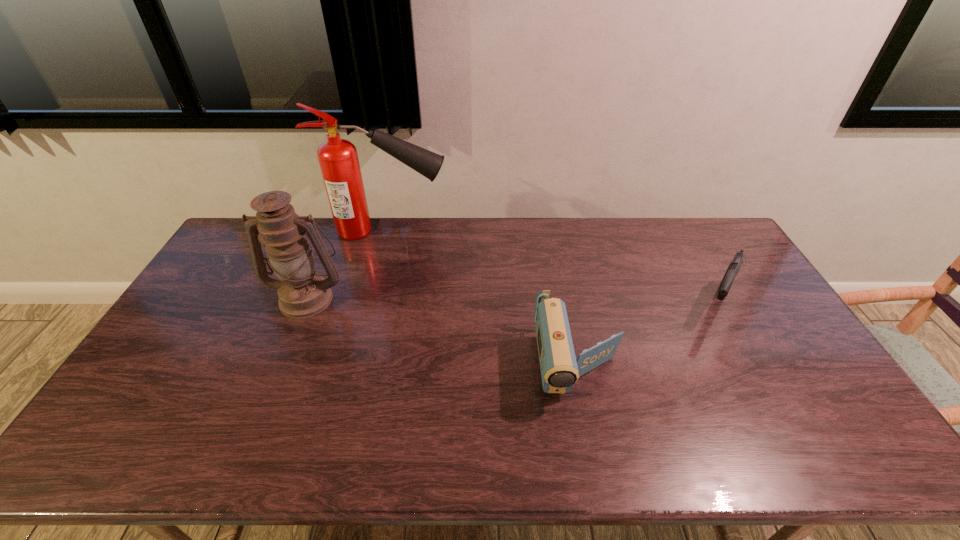
The height and width of the screenshot is (540, 960). In order to click on fire extinguisher in this screenshot , I will do `click(338, 159)`.

The width and height of the screenshot is (960, 540). In order to click on the tallest object in this screenshot , I will do `click(338, 159)`.

The image size is (960, 540). Identify the location of the second tallest object. (302, 293).

Where is `camcorder`? This screenshot has width=960, height=540. camcorder is located at coordinates (559, 369).

Image resolution: width=960 pixels, height=540 pixels. What are the coordinates of `gun` in the screenshot? It's located at (726, 283).

This screenshot has width=960, height=540. In order to click on vacant region located at the nozzle of the tallest object in this screenshot , I will do `click(550, 231)`.

This screenshot has width=960, height=540. Identify the location of free region located 0.130m on the right of the oil lamp. (387, 298).

Identify the location of vacant area located 0.130m on the side of the third object from left to right with the flip-out screen. Image resolution: width=960 pixels, height=540 pixels. (597, 462).

Where is `free space located 0.050m at the muzzle of the gun`? free space located 0.050m at the muzzle of the gun is located at coordinates (738, 341).

Where is `object that is at the far edge`? object that is at the far edge is located at coordinates (338, 159).